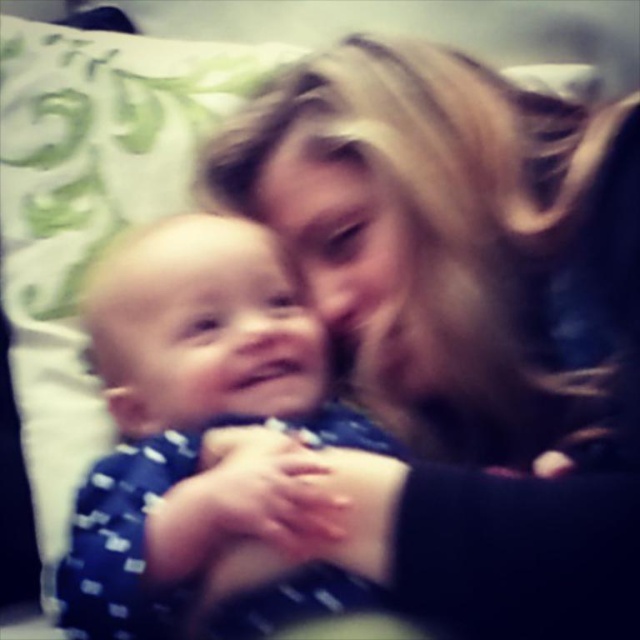
Can you confirm if blonde hair at upper center is positioned to the right of blue dotted fabric at center?

Yes, blonde hair at upper center is to the right of blue dotted fabric at center.

Is blonde hair at upper center positioned in front of blue dotted fabric at center?

That is True.

Does point (376, 104) come closer to viewer compared to point (184, 458)?

No.

Identify the location of blonde hair at upper center. The height and width of the screenshot is (640, 640). (467, 323).